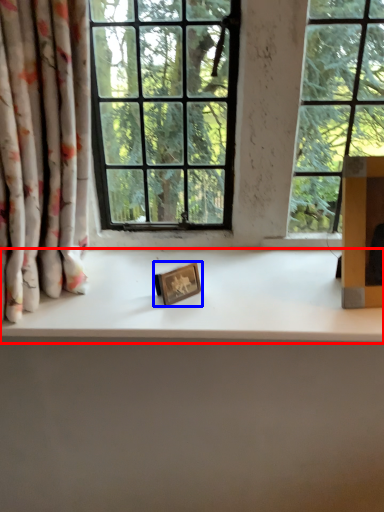
Question: Which point is further to the camera, counter top (highlighted by a red box) or picture frame (highlighted by a blue box)?

Choices:
 (A) counter top
 (B) picture frame

Answer: (B)